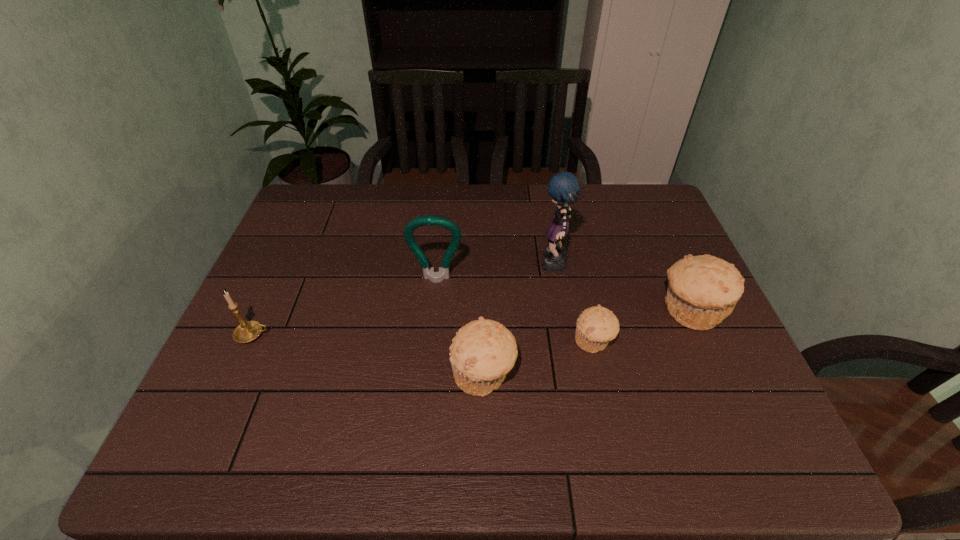
At what (x,y) coordinates should I click in order to perform the action: click on vacant space positioned on the front-facing side of the rag doll. Please return your answer as a coordinate pair (x, y). This screenshot has height=540, width=960. Looking at the image, I should click on (501, 266).

At what (x,y) coordinates should I click in order to perform the action: click on vacant area situated 0.060m on the front-facing side of the rag doll. Please return your answer as a coordinate pair (x, y). The width and height of the screenshot is (960, 540). Looking at the image, I should click on (518, 266).

Where is `free space located 0.260m on the front-facing side of the rag doll`? The image size is (960, 540). free space located 0.260m on the front-facing side of the rag doll is located at coordinates (449, 266).

You are a GUI agent. You are given a task and a screenshot of the screen. Output one action in this format:
    pyautogui.click(x=<x>, y=<y>)
    Task: Click on the free space located 0.090m on the handle side of the candle holder
    
    Given the screenshot: What is the action you would take?
    pyautogui.click(x=307, y=335)

Find the location of a particular element. Image resolution: width=960 pixels, height=540 pixels. vacant space located 0.340m at the jaws of the fifth shortest object is located at coordinates (424, 399).

Locate an element on the screen. object at the near edge is located at coordinates (483, 351).

The height and width of the screenshot is (540, 960). Identify the location of object situated at the left edge. (248, 331).

Identify the location of object present at the right edge. (703, 290).

Image resolution: width=960 pixels, height=540 pixels. Find the location of `blank space at the far edge of the desktop`. blank space at the far edge of the desktop is located at coordinates (480, 224).

Identify the location of free region at the near edge. (502, 392).